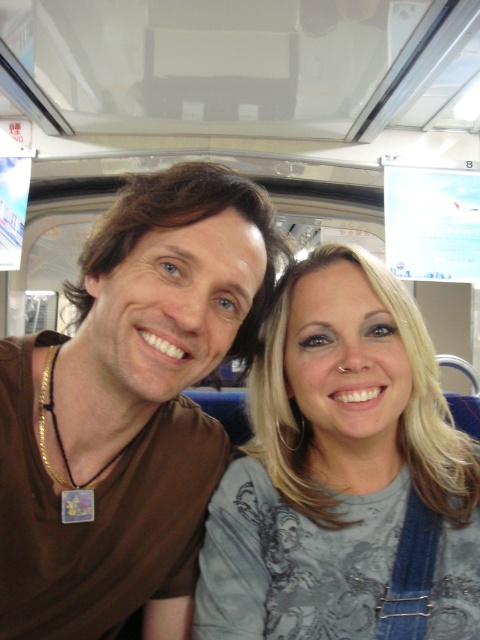
Question: Is brown matte shirt at center above gray fabric shirt at center?

Choices:
 (A) yes
 (B) no

Answer: (A)

Question: Which point appears farthest from the camera in this image?

Choices:
 (A) (354, 440)
 (B) (43, 484)

Answer: (A)

Question: Considering the relative positions of brown matte shirt at center and gray fabric shirt at center in the image provided, where is brown matte shirt at center located with respect to gray fabric shirt at center?

Choices:
 (A) below
 (B) above

Answer: (B)

Question: Does brown matte shirt at center appear under gray fabric shirt at center?

Choices:
 (A) no
 (B) yes

Answer: (A)